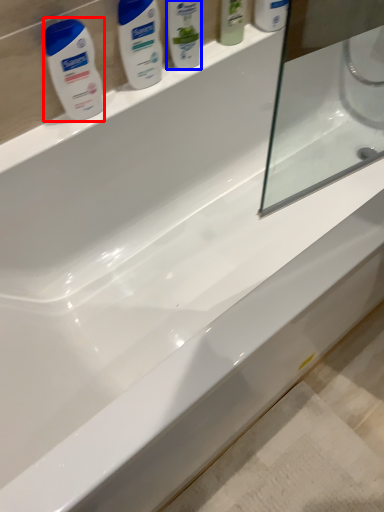
Question: Which object appears closest to the camera in this image, cleaning product (highlighted by a red box) or cleaning product (highlighted by a blue box)?

Choices:
 (A) cleaning product
 (B) cleaning product

Answer: (A)